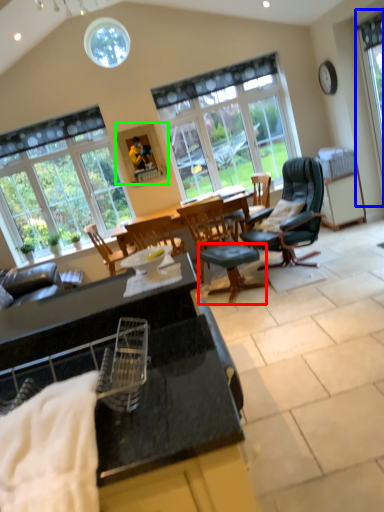
Question: Which object is the closest to the stool (highlighted by a red box)? Choose among these: window (highlighted by a blue box) or picture frame (highlighted by a green box).

Choices:
 (A) window
 (B) picture frame

Answer: (B)